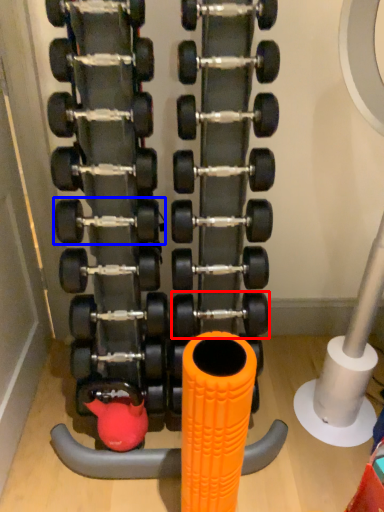
Question: Which point is further to the camera, dumbbell (highlighted by a red box) or dumbbell (highlighted by a blue box)?

Choices:
 (A) dumbbell
 (B) dumbbell

Answer: (A)